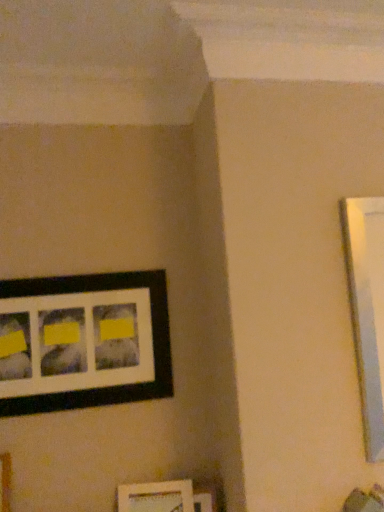
Question: Does matte black picture frame at lower center, which ranks as the 3th picture frame in top-to-bottom order, come in front of matte black picture frame at upper left, which is counted as the first picture frame, starting from the top?

Choices:
 (A) yes
 (B) no

Answer: (B)

Question: Considering the relative sizes of matte black picture frame at lower center, which ranks as the 3th picture frame in top-to-bottom order, and matte black picture frame at upper left, positioned as the third picture frame in bottom-to-top order, in the image provided, is matte black picture frame at lower center, which ranks as the 3th picture frame in top-to-bottom order, shorter than matte black picture frame at upper left, positioned as the third picture frame in bottom-to-top order,?

Choices:
 (A) no
 (B) yes

Answer: (B)

Question: Is there a large distance between matte black picture frame at lower center, which ranks as the 3th picture frame in top-to-bottom order, and matte black picture frame at upper left, which is counted as the first picture frame, starting from the top?

Choices:
 (A) no
 (B) yes

Answer: (A)

Question: Does matte black picture frame at lower center, which ranks as the 3th picture frame in top-to-bottom order, have a greater width compared to matte black picture frame at upper left, positioned as the third picture frame in bottom-to-top order?

Choices:
 (A) yes
 (B) no

Answer: (B)

Question: Does matte black picture frame at lower center, the first picture frame ordered from the bottom, appear on the left side of matte black picture frame at upper left, which is counted as the first picture frame, starting from the top?

Choices:
 (A) no
 (B) yes

Answer: (A)

Question: Based on their sizes in the image, would you say matte black picture frame at upper left, positioned as the third picture frame in bottom-to-top order, is bigger or smaller than matte black picture frame at lower center, which ranks as the 3th picture frame in top-to-bottom order?

Choices:
 (A) small
 (B) big

Answer: (B)

Question: In terms of width, does matte black picture frame at upper left, which is counted as the first picture frame, starting from the top, look wider or thinner when compared to matte black picture frame at lower center, which ranks as the 3th picture frame in top-to-bottom order?

Choices:
 (A) thin
 (B) wide

Answer: (B)

Question: From the image's perspective, is matte black picture frame at upper left, which is counted as the first picture frame, starting from the top, above or below matte black picture frame at lower center, which ranks as the 3th picture frame in top-to-bottom order?

Choices:
 (A) below
 (B) above

Answer: (B)

Question: Is matte black picture frame at upper left, positioned as the third picture frame in bottom-to-top order, situated inside matte black picture frame at lower center, which ranks as the 3th picture frame in top-to-bottom order, or outside?

Choices:
 (A) inside
 (B) outside

Answer: (B)

Question: Do you think matte black picture frame at lower center, which ranks as the 3th picture frame in top-to-bottom order, is within white matte picture frame at lower center, the 2th picture frame positioned from the top, or outside of it?

Choices:
 (A) inside
 (B) outside

Answer: (B)

Question: From the image's perspective, is matte black picture frame at lower center, which ranks as the 3th picture frame in top-to-bottom order, above or below white matte picture frame at lower center, the 2th picture frame positioned from the top?

Choices:
 (A) above
 (B) below

Answer: (B)

Question: Relative to white matte picture frame at lower center, the second picture frame ordered from the bottom, is matte black picture frame at lower center, the first picture frame ordered from the bottom, in front or behind?

Choices:
 (A) front
 (B) behind

Answer: (B)

Question: Based on their positions, is matte black picture frame at lower center, which ranks as the 3th picture frame in top-to-bottom order, located to the left or right of white matte picture frame at lower center, the second picture frame ordered from the bottom?

Choices:
 (A) right
 (B) left

Answer: (A)

Question: Is white matte picture frame at lower center, the 2th picture frame positioned from the top, inside or outside of matte black picture frame at lower center, which ranks as the 3th picture frame in top-to-bottom order?

Choices:
 (A) outside
 (B) inside

Answer: (A)

Question: Based on their positions, is white matte picture frame at lower center, the second picture frame ordered from the bottom, located to the left or right of matte black picture frame at lower center, which ranks as the 3th picture frame in top-to-bottom order?

Choices:
 (A) left
 (B) right

Answer: (A)